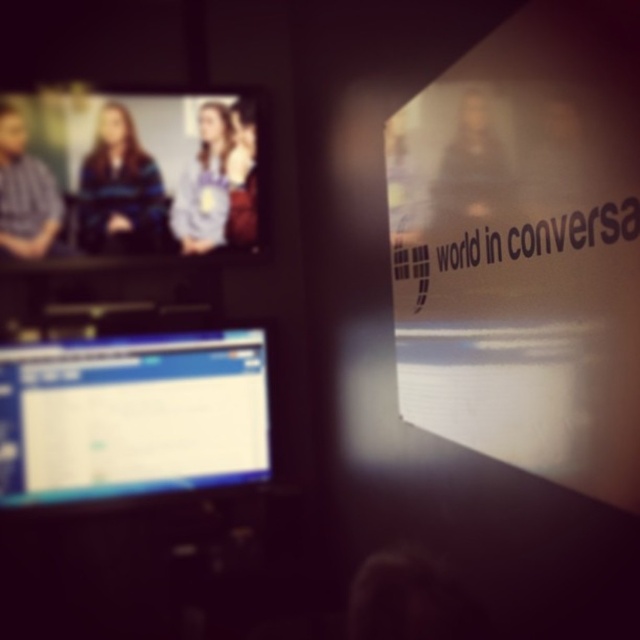
Question: Can you confirm if matte black monitor at lower left is smaller than matte black shirt at upper center?

Choices:
 (A) no
 (B) yes

Answer: (A)

Question: Can you confirm if light blue shirt at upper center is positioned below blue fabric shirt at upper left?

Choices:
 (A) yes
 (B) no

Answer: (A)

Question: Estimate the real-world distances between objects in this image. Which object is closer to the light blue shirt at upper center?

Choices:
 (A) matte blue shirt at left
 (B) matte black monitor at lower left

Answer: (A)

Question: Which of the following is the closest to the observer?

Choices:
 (A) (204, 385)
 (B) (472, 204)
 (C) (209, 172)
 (D) (115, 198)

Answer: (B)

Question: Which of the following is the closest to the observer?

Choices:
 (A) matte black monitor at lower left
 (B) matte black shirt at upper center
 (C) light blue shirt at upper center
 (D) matte blue shirt at left

Answer: (B)

Question: In this image, where is light blue shirt at upper center located relative to blue fabric shirt at upper left?

Choices:
 (A) right
 (B) left

Answer: (B)